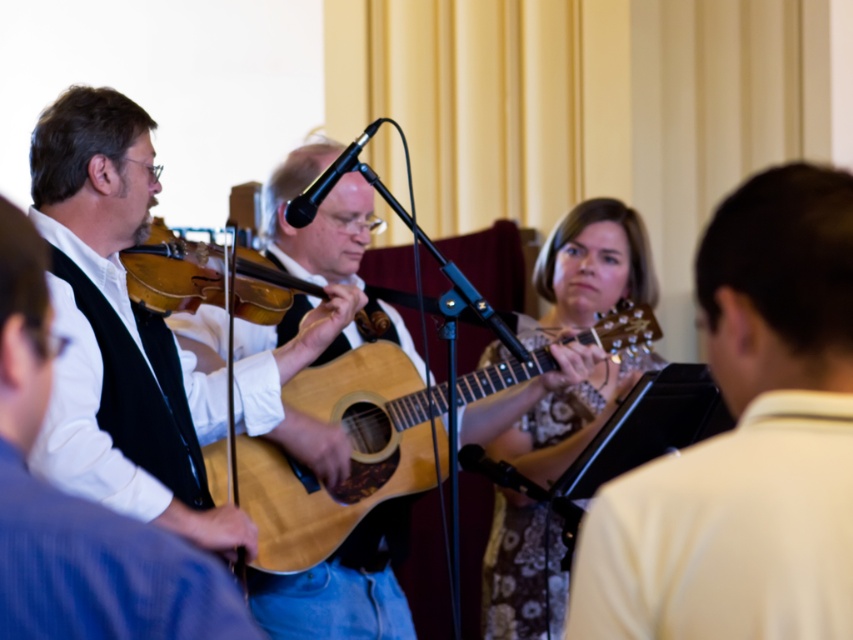
Question: Which of these objects is positioned farthest from the wooden acoustic guitar at center?

Choices:
 (A) light brown acoustic guitar at center
 (B) light brown wood guitar at center
 (C) floral-patterned fabric guitar at center

Answer: (B)

Question: Is wooden violin at left wider than wooden acoustic guitar at center?

Choices:
 (A) yes
 (B) no

Answer: (B)

Question: Which of the following is the farthest from the observer?

Choices:
 (A) light brown wood guitar at center
 (B) wooden acoustic guitar at center
 (C) matte black violin at left

Answer: (B)

Question: Can you confirm if light brown acoustic guitar at center is thinner than wooden acoustic guitar at center?

Choices:
 (A) yes
 (B) no

Answer: (B)

Question: Does light brown wood guitar at center appear over wooden acoustic guitar at center?

Choices:
 (A) no
 (B) yes

Answer: (B)

Question: Which object is farther from the camera taking this photo?

Choices:
 (A) light brown wood guitar at center
 (B) wooden violin at left

Answer: (B)